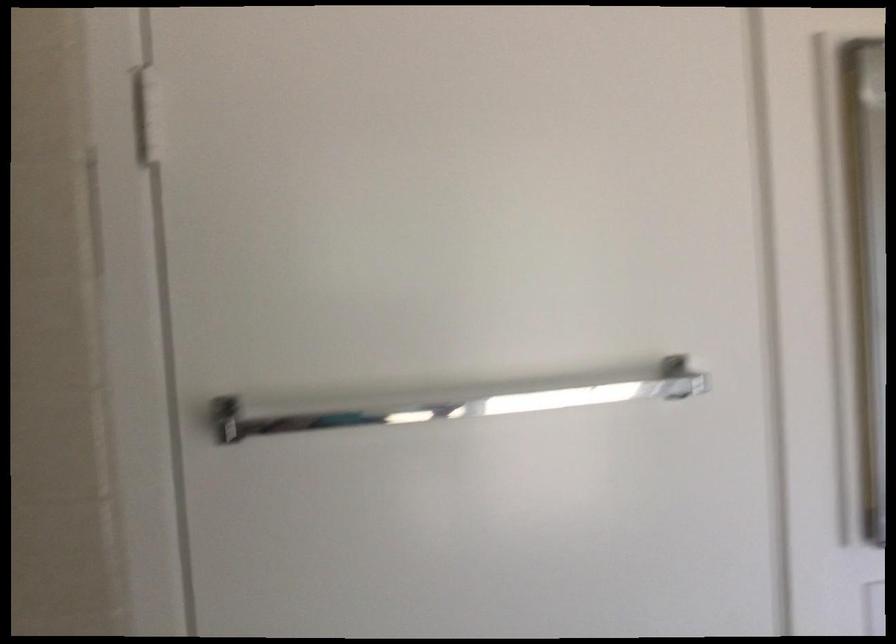
Find the location of a particular element. This screenshot has height=644, width=896. metal door handle is located at coordinates (455, 401).